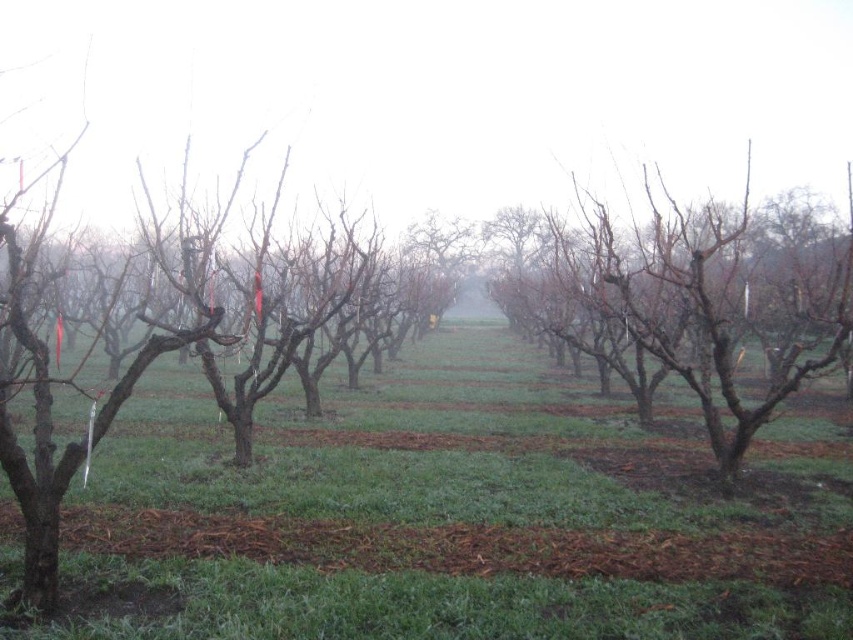
You are standing at the point marked as point [453,513] in the orchard. What is the immediate surface you are standing on?

The immediate surface at point [453,513] is green grass at center.

You are standing in the orchard and notice the green grass at center and the bare branches at center. Which of these two objects is located to the left of the other?

The green grass at center is positioned on the left side of the bare branches at center, so the green grass at center is to the left of the bare branches at center.